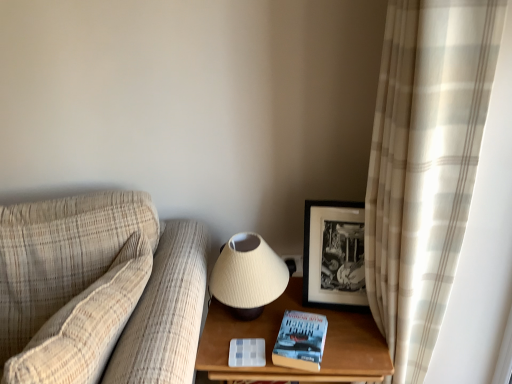
Question: From the image's perspective, is plaid fabric couch at left located beneath hardcover blue book at lower right?

Choices:
 (A) no
 (B) yes

Answer: (B)

Question: Can you confirm if plaid fabric couch at left is bigger than hardcover blue book at lower right?

Choices:
 (A) no
 (B) yes

Answer: (B)

Question: Does plaid fabric couch at left come behind hardcover blue book at lower right?

Choices:
 (A) no
 (B) yes

Answer: (A)

Question: Would you say plaid fabric couch at left is outside hardcover blue book at lower right?

Choices:
 (A) no
 (B) yes

Answer: (B)

Question: Can you confirm if plaid fabric couch at left is taller than hardcover blue book at lower right?

Choices:
 (A) yes
 (B) no

Answer: (A)

Question: From a real-world perspective, is plaid fabric couch at left positioned over hardcover blue book at lower right based on gravity?

Choices:
 (A) no
 (B) yes

Answer: (A)

Question: Is plaid fabric couch at left not near matte cream lampshade at center?

Choices:
 (A) no
 (B) yes

Answer: (A)

Question: Does plaid fabric couch at left appear on the left side of matte cream lampshade at center?

Choices:
 (A) yes
 (B) no

Answer: (A)

Question: Does plaid fabric couch at left touch matte cream lampshade at center?

Choices:
 (A) yes
 (B) no

Answer: (B)

Question: Is plaid fabric couch at left completely or partially outside of matte cream lampshade at center?

Choices:
 (A) no
 (B) yes

Answer: (B)

Question: Is matte cream lampshade at center a part of plaid fabric couch at left?

Choices:
 (A) no
 (B) yes

Answer: (A)

Question: Is plaid fabric couch at left smaller than matte cream lampshade at center?

Choices:
 (A) yes
 (B) no

Answer: (B)

Question: Considering the relative sizes of wooden table at lower right and matte cream lampshade at center in the image provided, is wooden table at lower right bigger than matte cream lampshade at center?

Choices:
 (A) no
 (B) yes

Answer: (B)